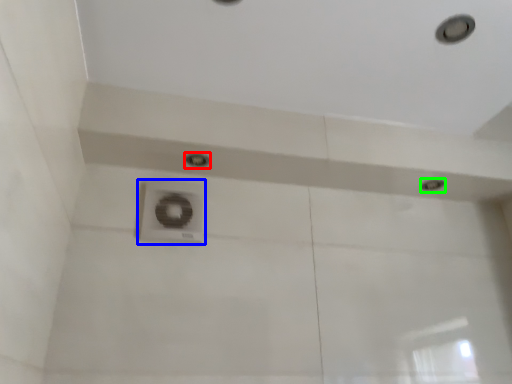
Question: Estimate the real-world distances between objects in this image. Which object is closer to droplight (highlighted by a red box), plumbing fixture (highlighted by a blue box) or droplight (highlighted by a green box)?

Choices:
 (A) plumbing fixture
 (B) droplight

Answer: (A)